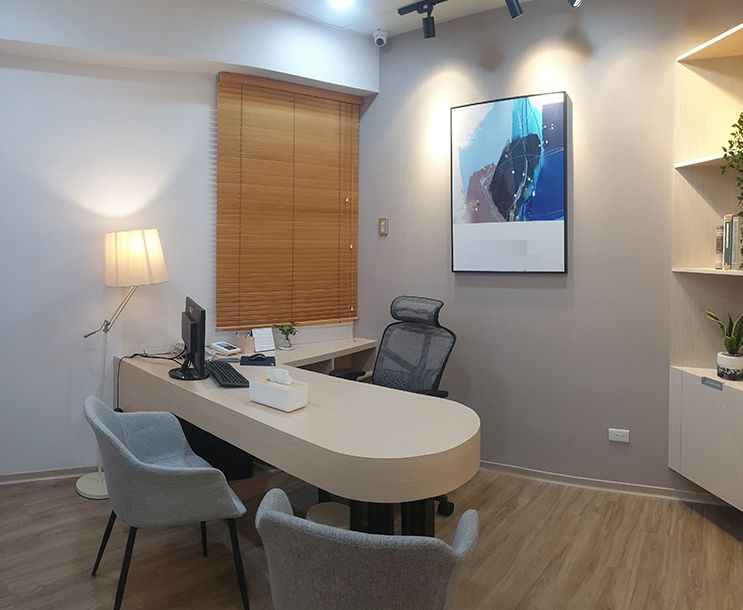
Locate an element on the screen. The image size is (743, 610). chairs is located at coordinates (158, 461), (363, 562), (409, 338).